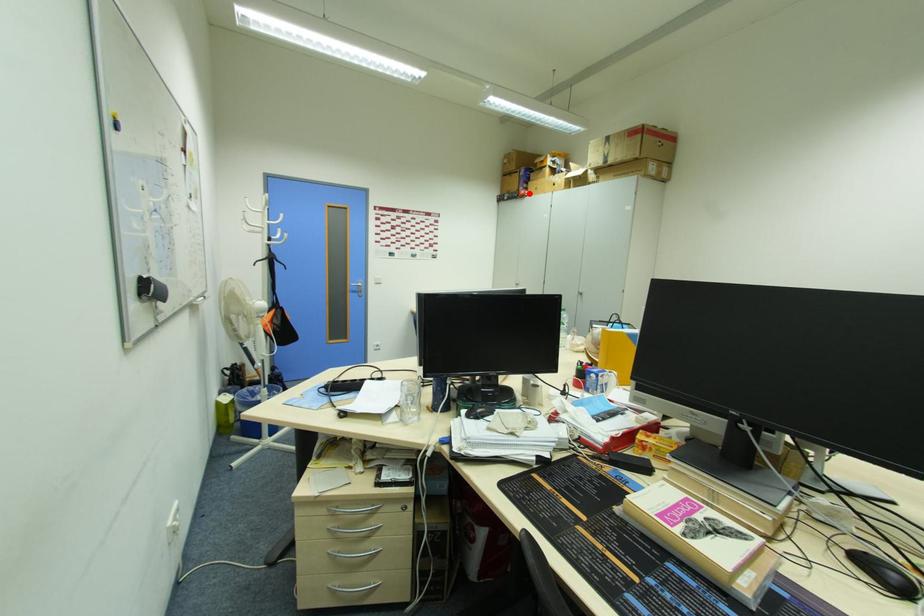
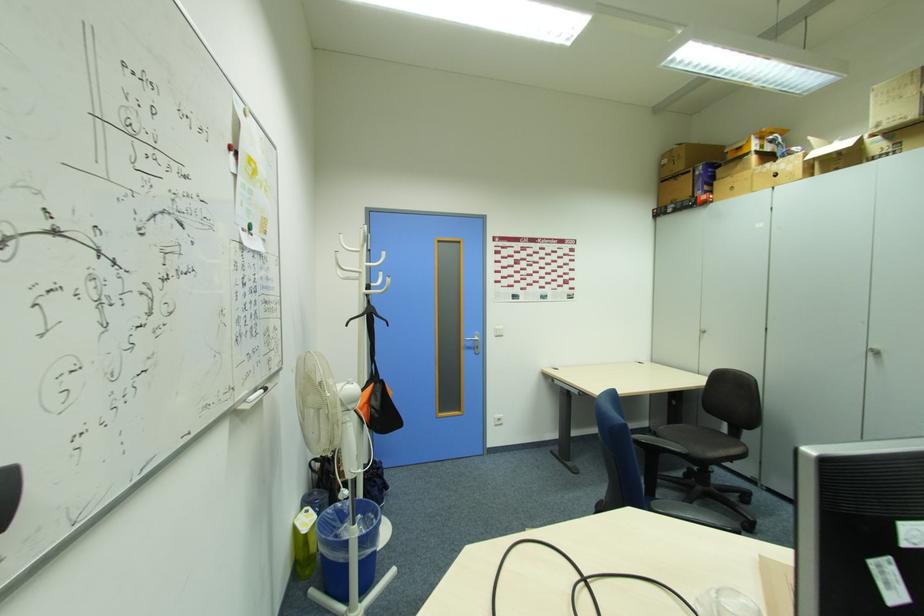
Where in the second image is the point corresponding to the highlighted location from the first image?

(714, 198)